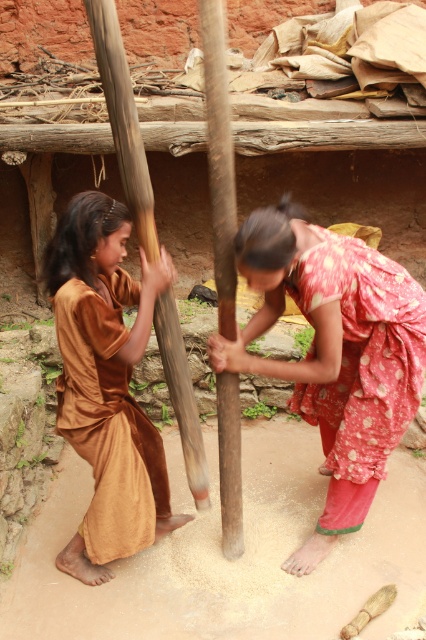
Looking at this image, you are designing a display for a cultural exhibition and need to place the polka dot fabric at center and the brown wooden pole at left. Given their sizes, which object should be placed closer to the front of the display to ensure both are visible?

The polka dot fabric at center is bigger than the brown wooden pole at left, so placing the smaller brown wooden pole at left closer to the front of the display will help ensure both objects are visible without one blocking the other.

You are a tailor observing two fabrics in the image. The polka dot fabric at center and the brown velvet dress at left are both visible. Which fabric is positioned to the right of the other?

The polka dot fabric at center is to the right of the brown velvet dress at left.